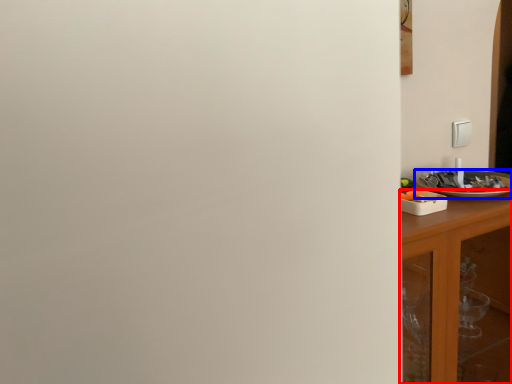
Question: Which point is further to the camera, cabinetry (highlighted by a red box) or tableware (highlighted by a blue box)?

Choices:
 (A) cabinetry
 (B) tableware

Answer: (B)